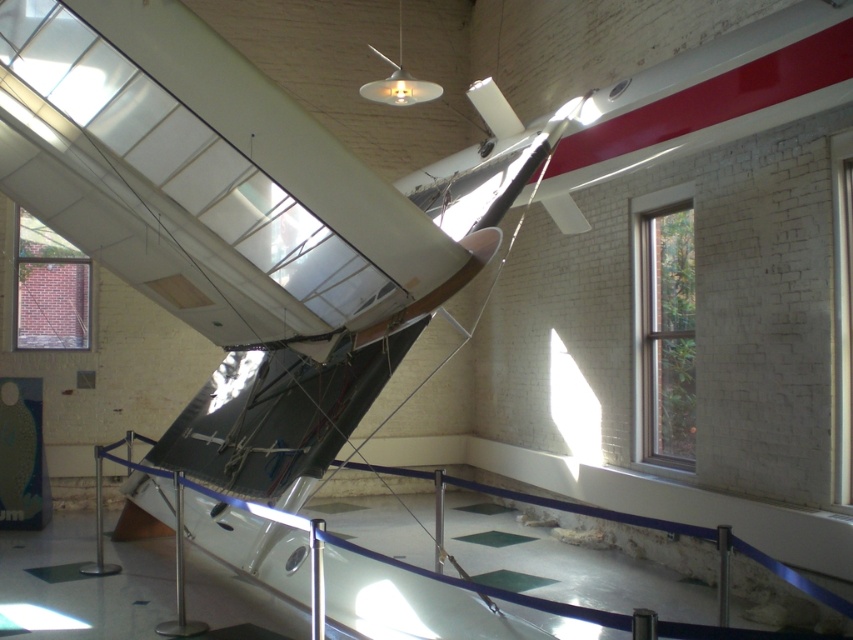
Does point (648, 323) come closer to viewer compared to point (30, 314)?

Yes, it is in front of point (30, 314).

Can you confirm if clear glass window at right is positioned to the left of brick wall at upper left?

No, clear glass window at right is not to the left of brick wall at upper left.

This screenshot has width=853, height=640. I want to click on clear glass window at right, so click(x=663, y=326).

Is brick wall at upper left to the right of clear glass window at upper right from the viewer's perspective?

No, brick wall at upper left is not to the right of clear glass window at upper right.

Consider the image. Who is taller, brick wall at upper left or clear glass window at upper right?

clear glass window at upper right is taller.

The height and width of the screenshot is (640, 853). Describe the element at coordinates (49, 289) in the screenshot. I see `brick wall at upper left` at that location.

The width and height of the screenshot is (853, 640). I want to click on brick wall at upper left, so click(x=49, y=289).

Can you confirm if clear glass window at right is wider than clear glass window at upper right?

Correct, the width of clear glass window at right exceeds that of clear glass window at upper right.

Which is in front, point (671, 385) or point (840, 305)?

Positioned in front is point (840, 305).

I want to click on clear glass window at right, so click(x=663, y=326).